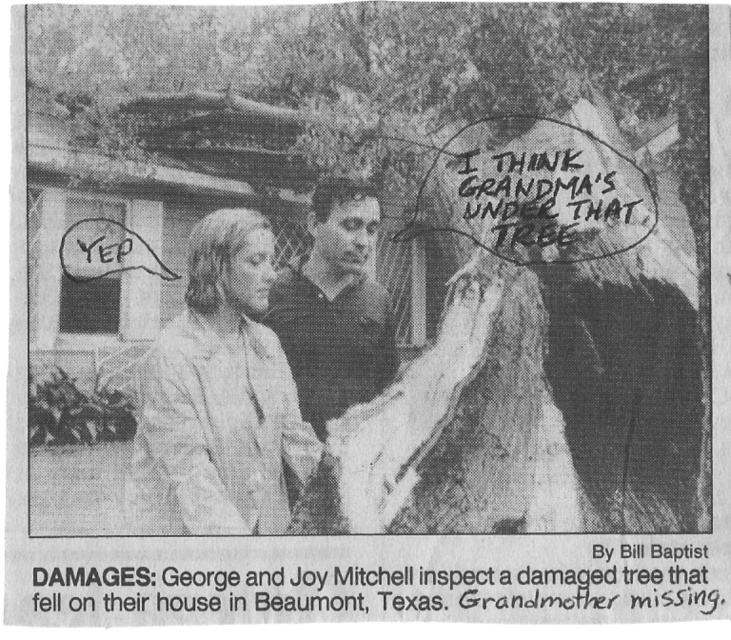
Is damaged wood tree at center below black handwritten text at upper center?

Correct, damaged wood tree at center is located below black handwritten text at upper center.

Is damaged wood tree at center smaller than black handwritten text at upper center?

No, damaged wood tree at center is not smaller than black handwritten text at upper center.

Does point (719, 588) come farther from viewer compared to point (512, 176)?

No, (719, 588) is closer to viewer.

In order to click on damaged wood tree at center in this screenshot , I will do 390,573.

Based on the photo, who is more distant from viewer, (260,480) or (292,298)?

Point (292,298)

Locate an element on the screen. light beige fabric jacket at left is located at coordinates (219, 397).

From the picture: Is damaged wood tree at center wider than light beige fabric jacket at left?

Yes.

Which is behind, point (531, 545) or point (257, 227)?

The point (257, 227) is behind.

Between point (265, 618) and point (211, 356), which one is positioned in front?

Point (265, 618)

This screenshot has height=640, width=731. I want to click on damaged wood tree at center, so click(390, 573).